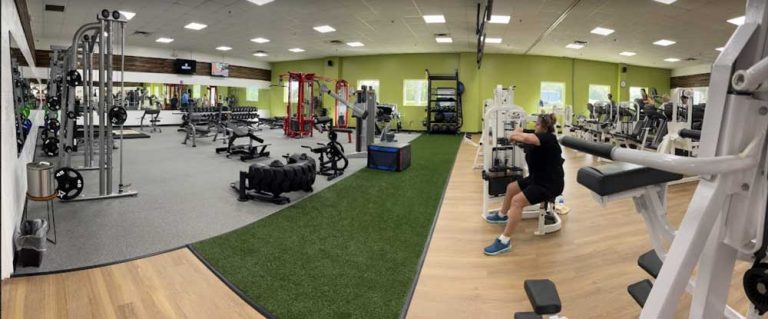
Locate an element on the screen. The width and height of the screenshot is (768, 319). trash can is located at coordinates (27, 261).